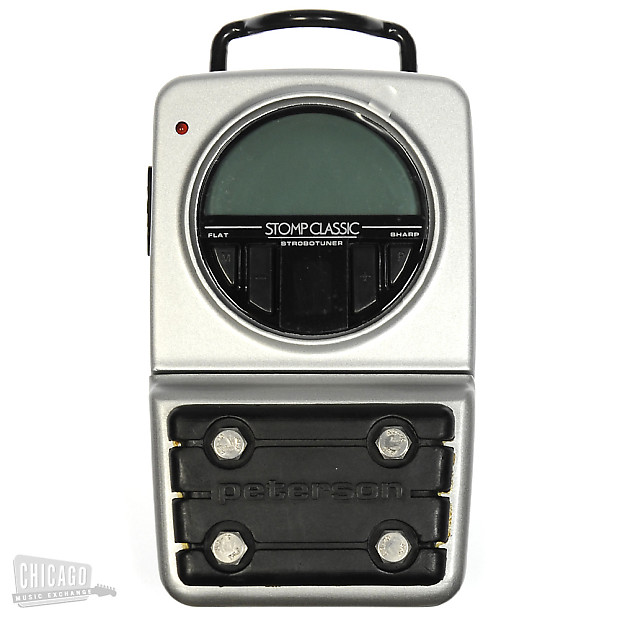
This screenshot has width=620, height=620. I want to click on handle, so click(x=339, y=23).